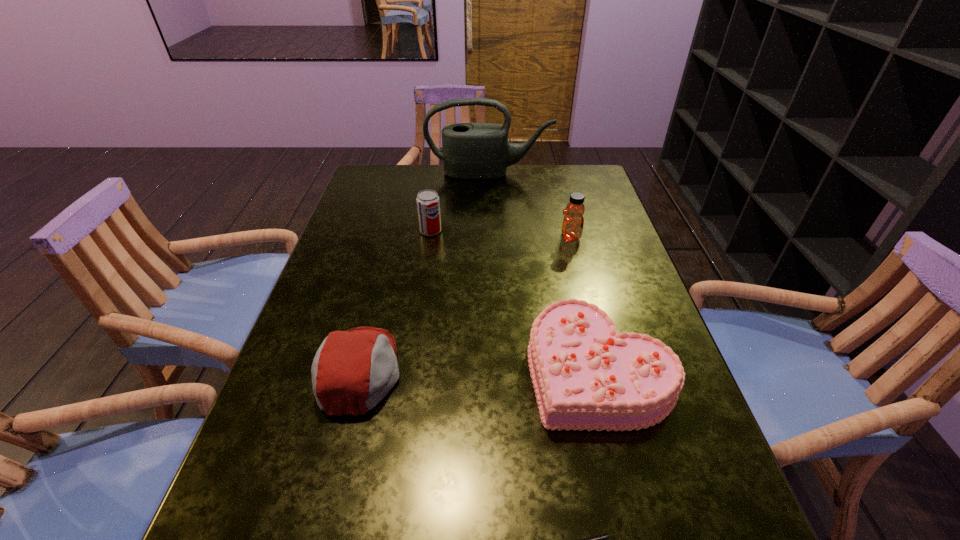
In the image, there is a desktop. Where is `vacant space at the left edge`? Image resolution: width=960 pixels, height=540 pixels. vacant space at the left edge is located at coordinates (282, 518).

In the image, there is a desktop. Where is `vacant space at the right edge`? This screenshot has width=960, height=540. vacant space at the right edge is located at coordinates (610, 205).

In order to click on free point at the far left corner in this screenshot , I will do `click(398, 170)`.

Where is `free region at the far right corner`? Image resolution: width=960 pixels, height=540 pixels. free region at the far right corner is located at coordinates (552, 177).

Locate an element on the screen. free space that is in between the cake and the fourth shortest object is located at coordinates (515, 300).

Where is `vacant space that is in between the farthest object and the cap`? The height and width of the screenshot is (540, 960). vacant space that is in between the farthest object and the cap is located at coordinates (424, 272).

Image resolution: width=960 pixels, height=540 pixels. Identify the location of free space that is in between the cake and the watering can. (543, 271).

Locate an element on the screen. This screenshot has height=540, width=960. free point between the cap and the tallest object is located at coordinates (424, 272).

Image resolution: width=960 pixels, height=540 pixels. I want to click on empty space that is in between the cap and the farthest object, so click(424, 272).

The height and width of the screenshot is (540, 960). What are the coordinates of `free space between the cap and the cake` in the screenshot? It's located at (479, 370).